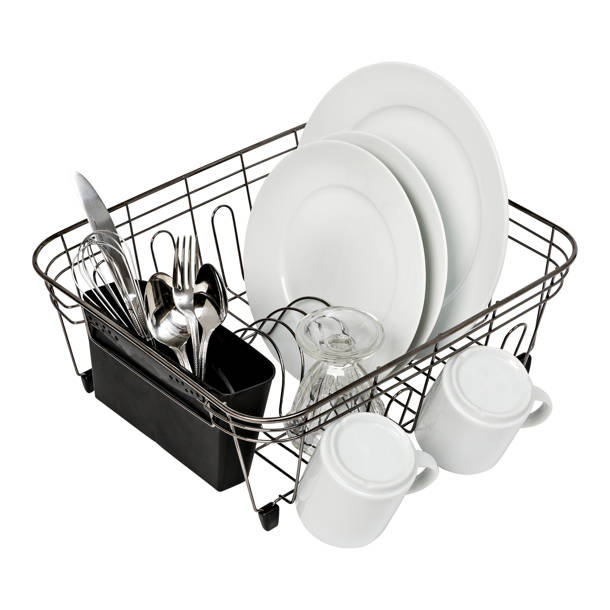
At what (x,y) coordinates should I click in order to perform the action: click on glass cups. Please return your answer as a coordinate pair (x, y). The image size is (610, 610). Looking at the image, I should click on (340, 371).